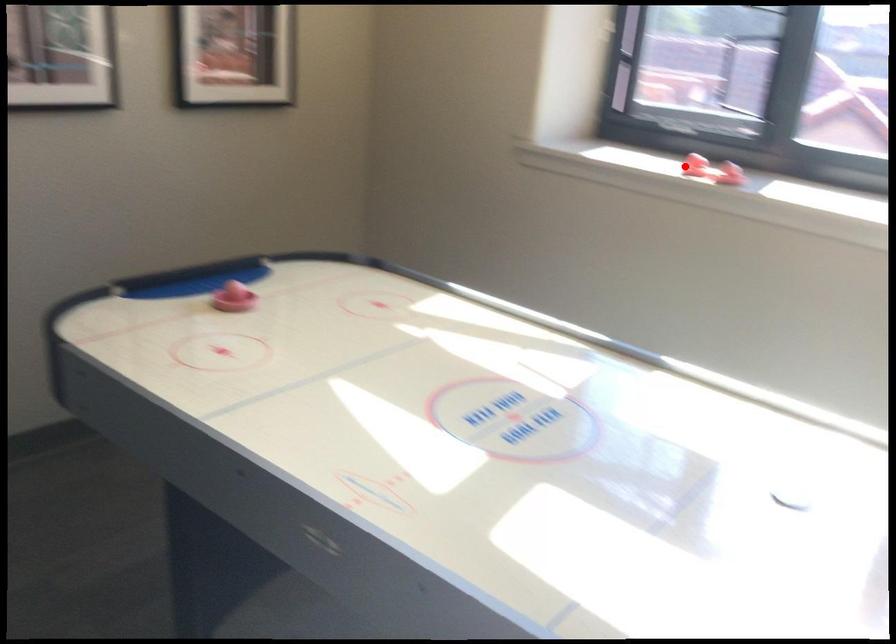
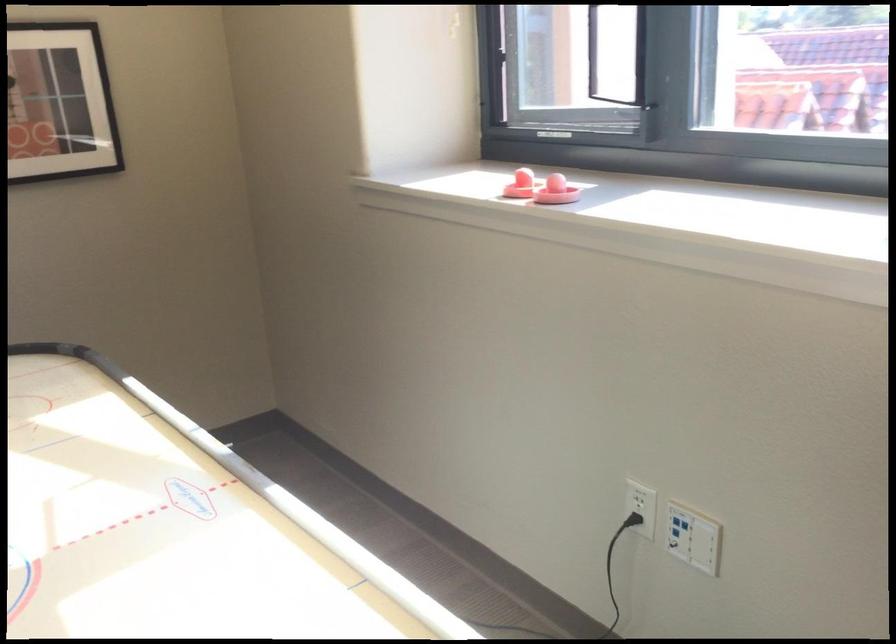
Question: I am providing you with two images of the same scene from different viewpoints. In image1, a red point is highlighted. Considering the same 3D point in image2, which of the following is correct?

Choices:
 (A) It is closer
 (B) It is farther

Answer: (A)